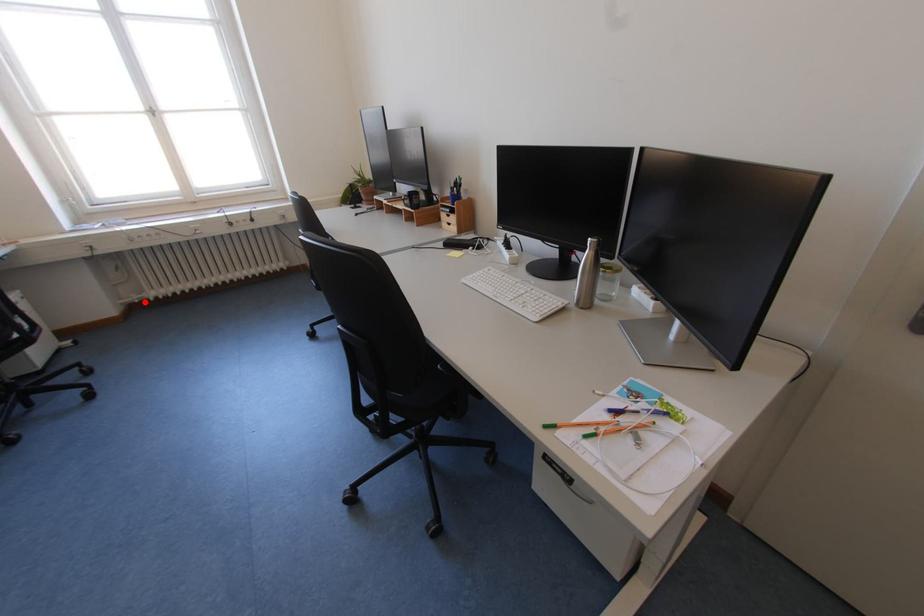
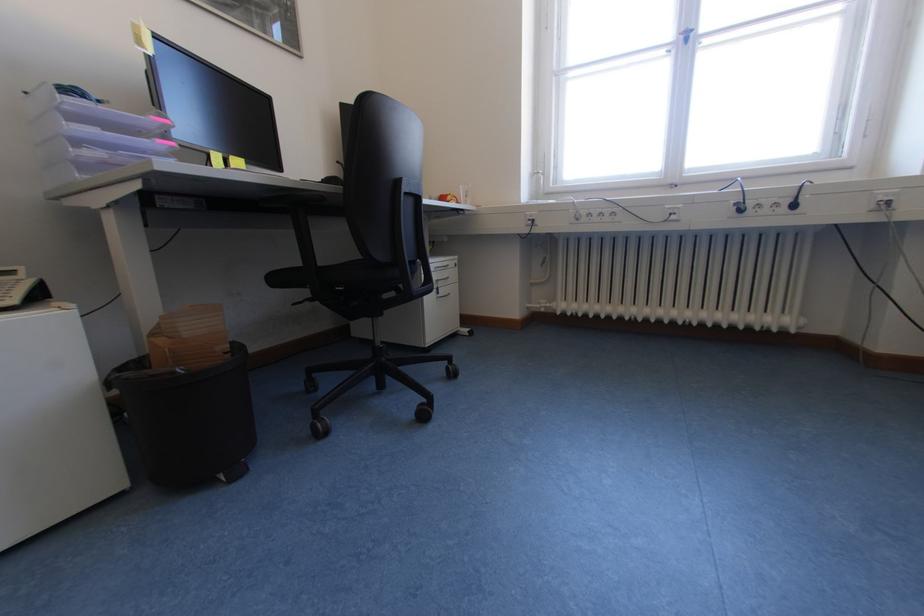
Question: I am providing you with two images of the same scene from different viewpoints. In image1, a red point is highlighted. Considering the same 3D point in image2, which of the following is correct?

Choices:
 (A) It is closer
 (B) It is farther

Answer: (B)